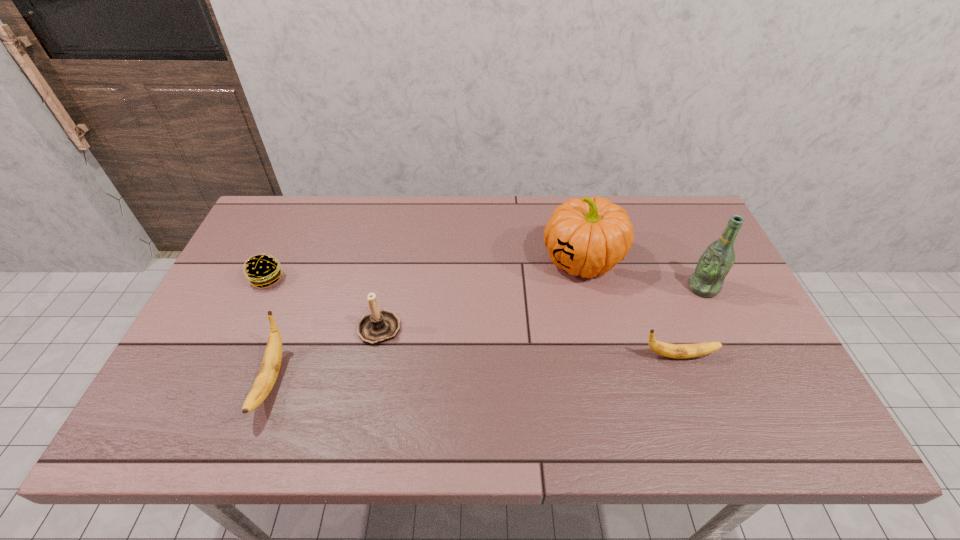
Locate an element on the screen. The width and height of the screenshot is (960, 540). vacant spot for a new banana to ensure equal spacing is located at coordinates (479, 368).